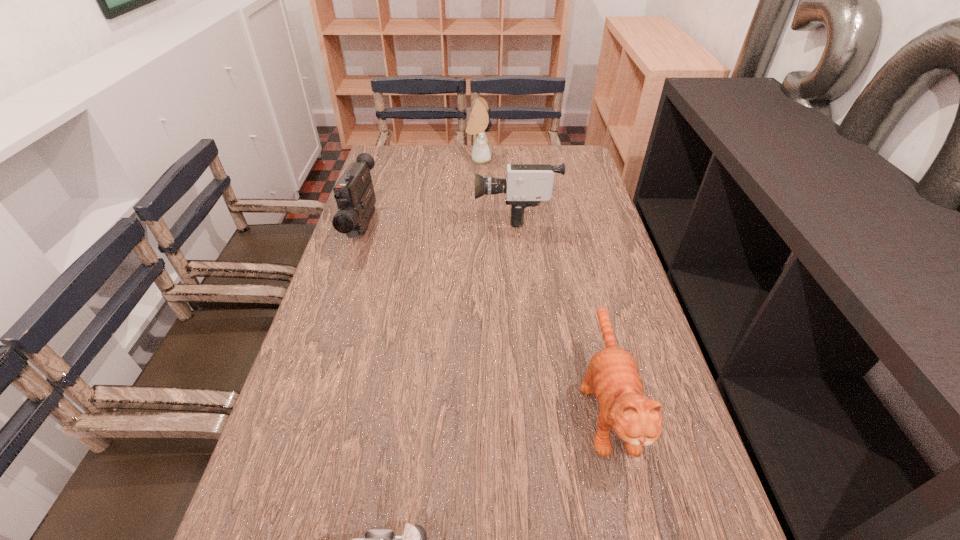
Where is `the farthest object`? the farthest object is located at coordinates (477, 125).

Where is `the rightmost camcorder`? The width and height of the screenshot is (960, 540). the rightmost camcorder is located at coordinates (526, 185).

Identify the location of the leftmost camcorder. The width and height of the screenshot is (960, 540). (354, 193).

Identify the location of the second nearest object. (612, 376).

You are a GUI agent. You are given a task and a screenshot of the screen. Output one action in this format:
    pyautogui.click(x=<x>, y=<y>)
    Task: Click on the vacant area situated at the front face of the farthest object
    The image size is (960, 540).
    Given the screenshot: What is the action you would take?
    pyautogui.click(x=529, y=159)

Locate an element on the screen. The image size is (960, 540). free space located on the recording direction of the rightmost camcorder is located at coordinates (x=392, y=213).

Image resolution: width=960 pixels, height=540 pixels. Find the location of `vacant space positioned on the recording direction of the rightmost camcorder`. vacant space positioned on the recording direction of the rightmost camcorder is located at coordinates (453, 213).

This screenshot has height=540, width=960. Find the location of `free region located 0.320m on the recording direction of the rightmost camcorder`. free region located 0.320m on the recording direction of the rightmost camcorder is located at coordinates (376, 213).

What are the coordinates of `free location located on the front-facing side of the leftmost camcorder` in the screenshot? It's located at (343, 290).

I want to click on object that is at the far edge, so click(477, 125).